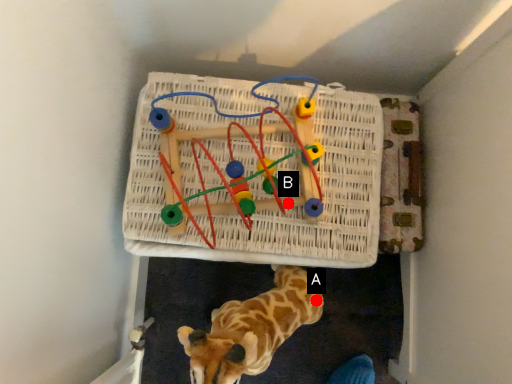
Question: Two points are circled on the image, labeled by A and B beside each circle. Which point is farther to the camera?

Choices:
 (A) A is further
 (B) B is further

Answer: (A)